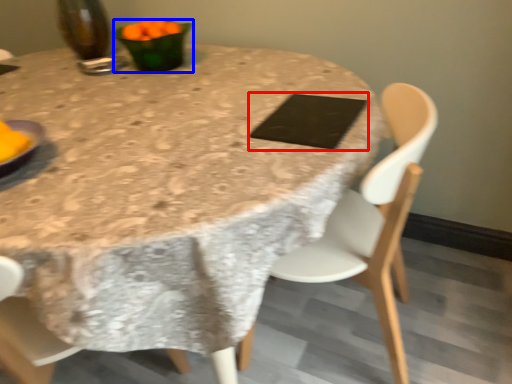
Question: Which point is closer to the camera, pad (highlighted by a red box) or tableware (highlighted by a blue box)?

Choices:
 (A) pad
 (B) tableware

Answer: (A)